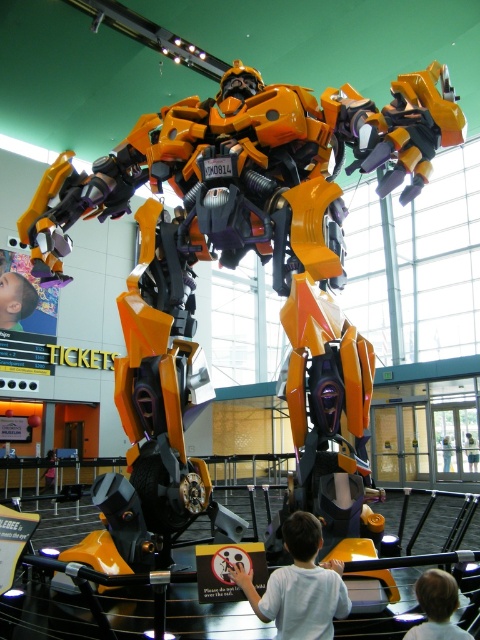
You are a parent standing near the robot display and see both the white matte shirt at lower center and the smooth skin child at lower right. Which one is closer to you?

The white matte shirt at lower center is closer to you because it is further to the viewer than the smooth skin child at lower right.

You are a photographer planning to take a picture of the robot display. You notice the white matte shirt at lower center and the smooth skin child at lower right might block the view. Which object is bigger and could potentially block more of the robot in the photo?

The white matte shirt at lower center is larger in size compared to the smooth skin child at lower right, so it could potentially block more of the robot in the photo.